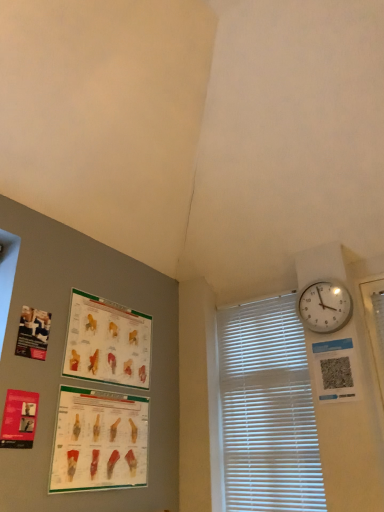
Question: Based on their sizes in the image, would you say matte paper poster at left, which is counted as the fourth poster page, starting from the bottom, is bigger or smaller than matte red poster at lower left, which is the 2th poster page in bottom-to-top order?

Choices:
 (A) small
 (B) big

Answer: (B)

Question: Considering the relative positions of matte paper poster at left, which is counted as the fourth poster page, starting from the bottom, and matte red poster at lower left, which is the 2th poster page in bottom-to-top order, in the image provided, is matte paper poster at left, which is counted as the fourth poster page, starting from the bottom, to the left or to the right of matte red poster at lower left, which is the 2th poster page in bottom-to-top order,?

Choices:
 (A) right
 (B) left

Answer: (B)

Question: Estimate the real-world distances between objects in this image. Which object is closer to the matte paper poster at left, the 1th poster page positioned from the top?

Choices:
 (A) matte paper poster at upper left, positioned as the third poster page in bottom-to-top order
 (B) matte paper poster at lower left, marked as the fourth poster page in a top-to-bottom arrangement
 (C) white glossy wall clock at upper right
 (D) matte red poster at lower left, which is the 2th poster page in bottom-to-top order
 (E) white plastic blinds at right

Answer: (D)

Question: Based on their relative distances, which object is farther from the matte red poster at lower left, acting as the third poster page starting from the top?

Choices:
 (A) white glossy wall clock at upper right
 (B) white plastic blinds at right
 (C) matte paper poster at lower left, marked as the fourth poster page in a top-to-bottom arrangement
 (D) matte paper poster at upper left, positioned as the third poster page in bottom-to-top order
 (E) matte paper poster at left, the 1th poster page positioned from the top

Answer: (A)